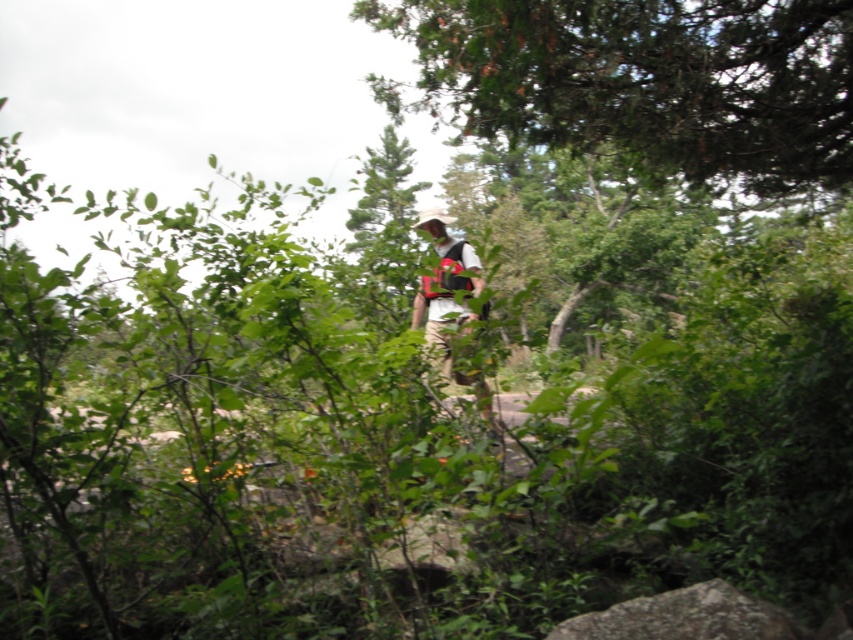
You are a hiker who wants to take a photo of the white cotton shirt at center without the green leafy tree at upper center blocking the view. Which direction should you move to ensure the tree is no longer in front of the shirt?

The green leafy tree at upper center is in front of the white cotton shirt at center. To avoid the tree blocking the view of the shirt, move either to the left or right of the current position to shift the angle so the tree is no longer between you and the shirt.

You are a hiker who wants to take a photo of the white cotton shirt at center without the green leafy tree at upper center blocking the view. Which direction should you move to ensure the tree is out of the frame?

The green leafy tree at upper center is above the white cotton shirt at center, so you should move downward or to the side away from the tree to position yourself where the tree is no longer in the frame above the shirt.

You are standing at the point labeled point (769, 32) and want to reach the point labeled point (450, 289). Which direction should you move relative to your current position?

You should move backward since point (769, 32) is in front of point (450, 289), meaning the destination is behind your current position.